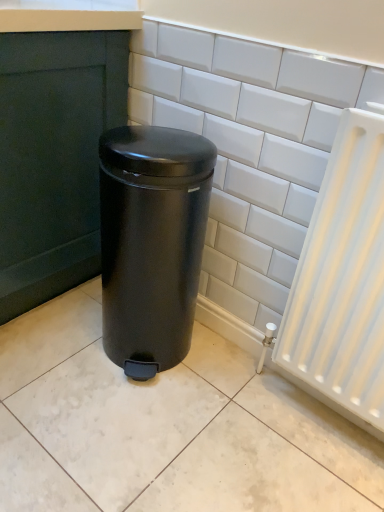
Question: Can you confirm if white glossy tile at center is wider than matte black trash can at center?

Choices:
 (A) no
 (B) yes

Answer: (A)

Question: Would you say white glossy tile at center contains matte black trash can at center?

Choices:
 (A) yes
 (B) no

Answer: (B)

Question: Can you confirm if white glossy tile at center is shorter than matte black trash can at center?

Choices:
 (A) no
 (B) yes

Answer: (A)

Question: Is white glossy tile at center behind matte black trash can at center?

Choices:
 (A) yes
 (B) no

Answer: (B)

Question: Does white glossy tile at center have a lesser width compared to matte black trash can at center?

Choices:
 (A) yes
 (B) no

Answer: (A)

Question: Is white glossy tile at center outside of matte black trash can at center?

Choices:
 (A) no
 (B) yes

Answer: (B)

Question: Does matte black trash can at center have a greater height compared to white glossy tile at center?

Choices:
 (A) yes
 (B) no

Answer: (B)

Question: Is matte black trash can at center further to the viewer compared to white glossy tile at center?

Choices:
 (A) no
 (B) yes

Answer: (B)

Question: Would you say matte black trash can at center contains white glossy tile at center?

Choices:
 (A) no
 (B) yes

Answer: (A)

Question: Is matte black trash can at center next to white glossy tile at center?

Choices:
 (A) yes
 (B) no

Answer: (B)

Question: Is matte black trash can at center completely or partially outside of white glossy tile at center?

Choices:
 (A) yes
 (B) no

Answer: (A)

Question: Is matte black trash can at center not near white glossy tile at center?

Choices:
 (A) yes
 (B) no

Answer: (B)

Question: Is white glossy tile at center in front of or behind matte black trash can at center in the image?

Choices:
 (A) front
 (B) behind

Answer: (A)